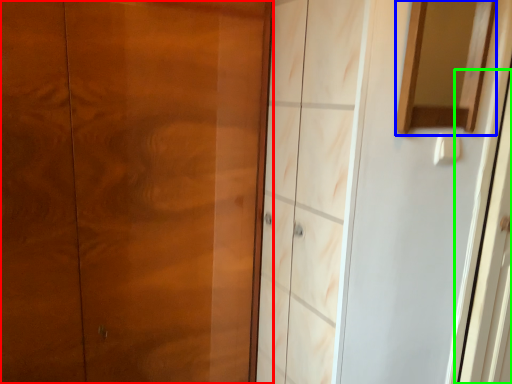
Question: Which is nearer to the door (highlighted by a red box)? mirror (highlighted by a blue box) or screen door (highlighted by a green box).

Choices:
 (A) mirror
 (B) screen door

Answer: (A)